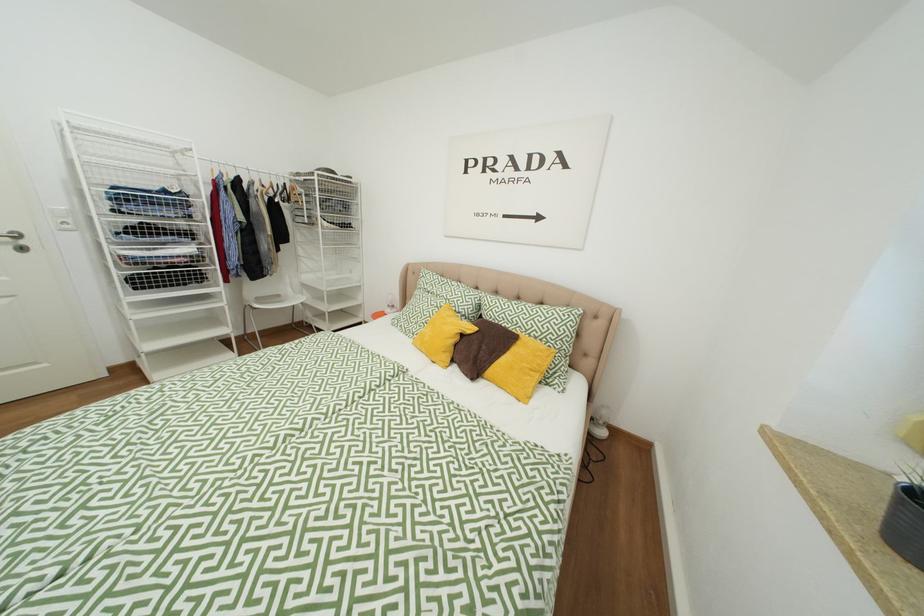
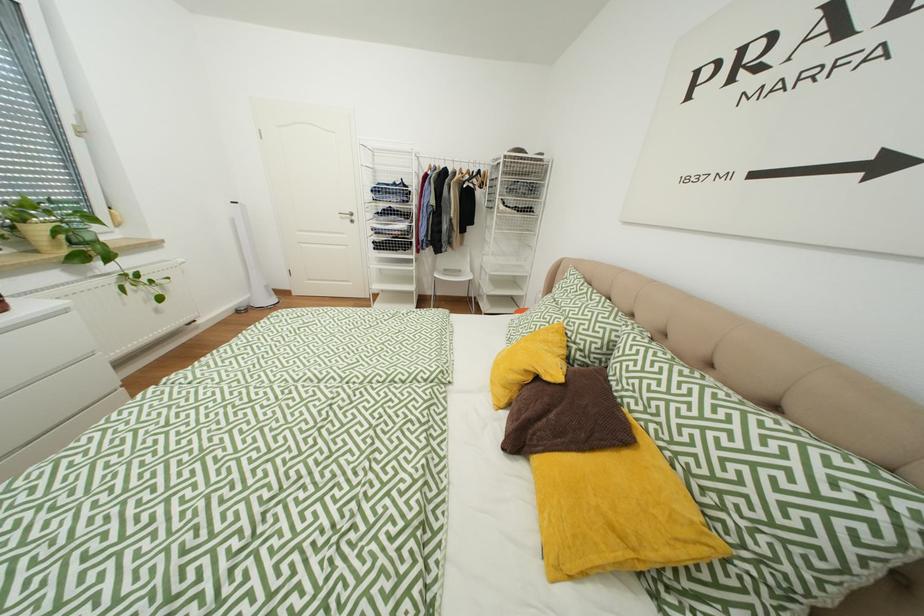
Question: The images are taken continuously from a first-person perspective. In which direction is your viewpoint rotating?

Choices:
 (A) Left
 (B) Right
 (C) Up
 (D) Down

Answer: (A)